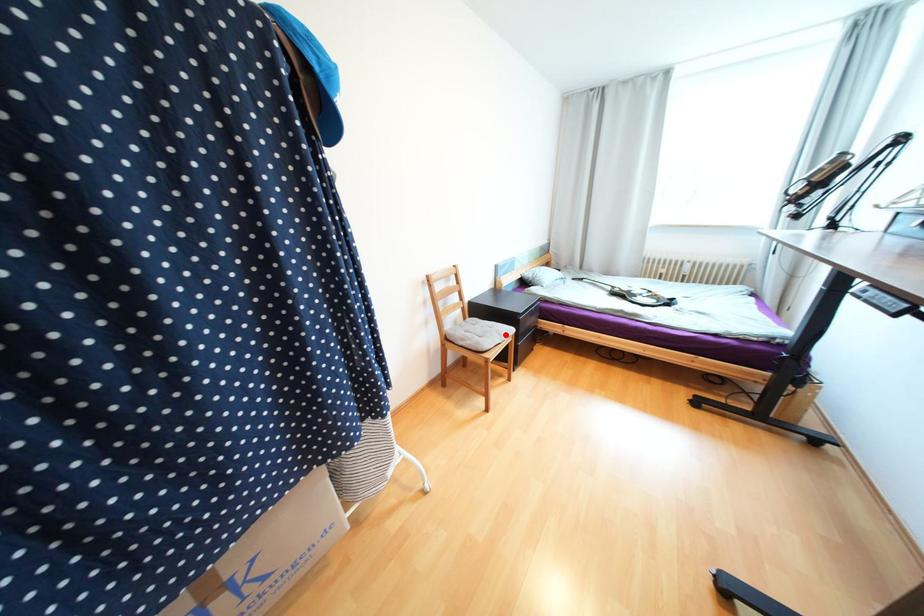
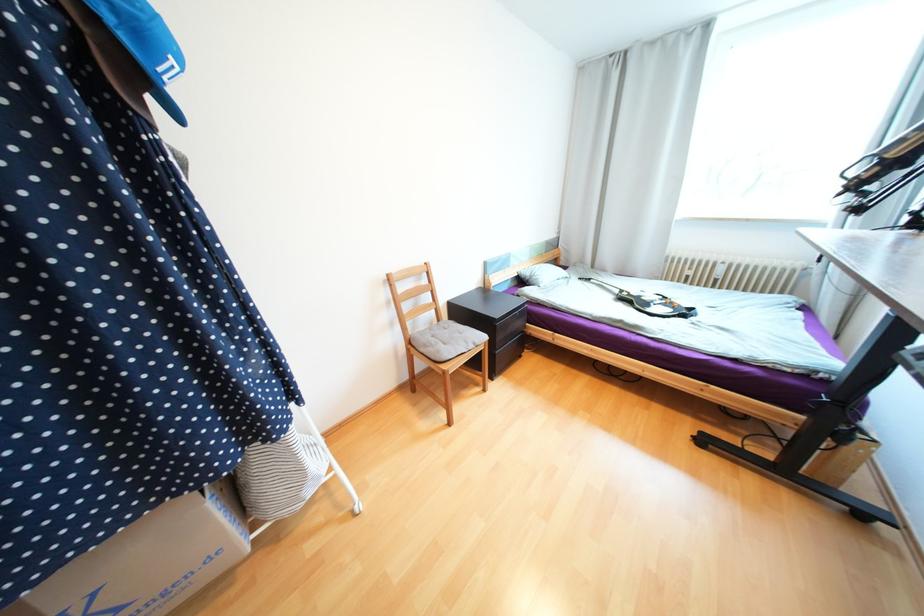
In the second image, find the point that corresponds to the highlighted location in the first image.

(472, 342)